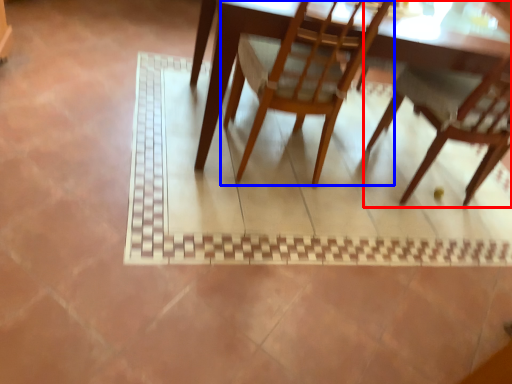
Question: Among these objects, which one is nearest to the camera, chair (highlighted by a red box) or chair (highlighted by a blue box)?

Choices:
 (A) chair
 (B) chair

Answer: (B)